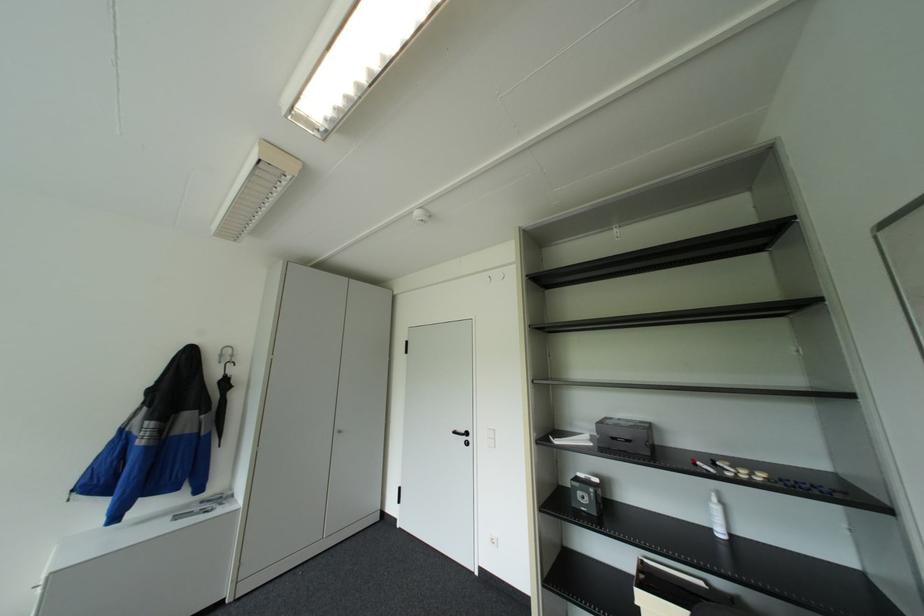
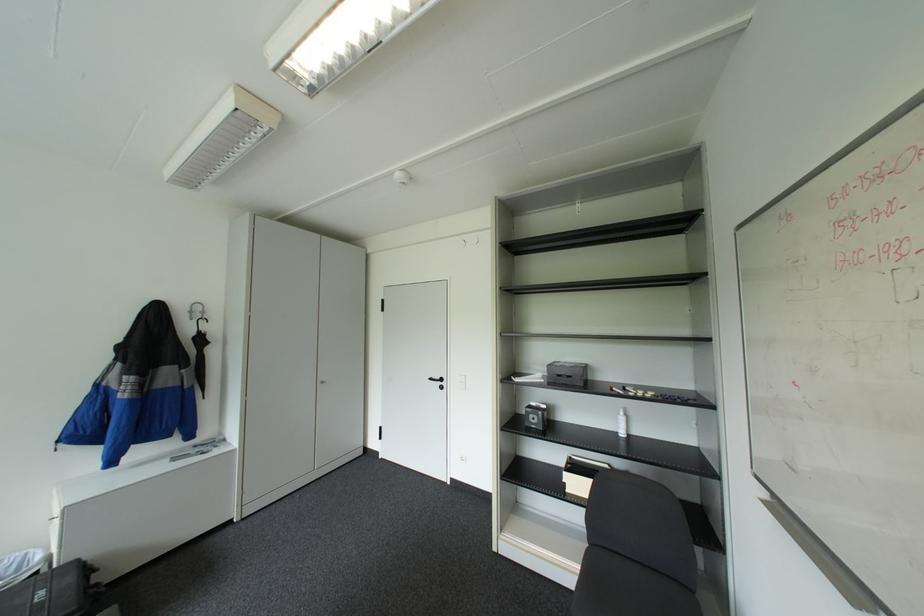
The point at (227, 361) is marked in the first image. Where is the corresponding point in the second image?

(200, 318)